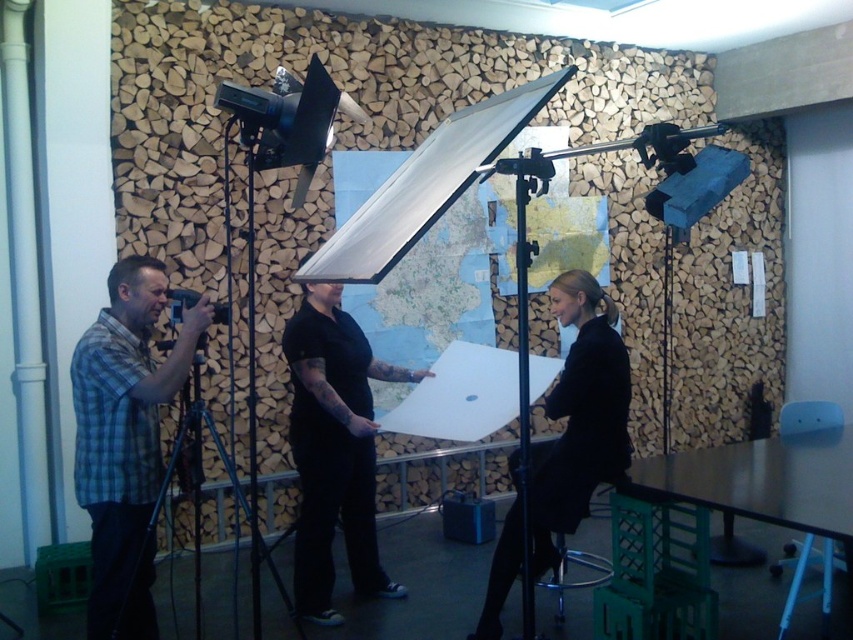
Question: Which point is closer to the camera?

Choices:
 (A) (149, 506)
 (B) (492, 621)
 (C) (328, 433)
 (D) (248, 516)

Answer: (A)

Question: Does black matte shirt at center come behind blue metallic tripod at left?

Choices:
 (A) no
 (B) yes

Answer: (B)

Question: Considering the real-world distances, which object is closest to the plaid shirt at left?

Choices:
 (A) blue metallic tripod at left
 (B) black matte dress at center
 (C) black matte shirt at center

Answer: (A)

Question: Among these objects, which one is farthest from the camera?

Choices:
 (A) plaid shirt at left
 (B) blue metallic tripod at left
 (C) black matte dress at center
 (D) black matte shirt at center

Answer: (D)

Question: Is the position of plaid shirt at left more distant than that of blue metallic tripod at left?

Choices:
 (A) no
 (B) yes

Answer: (B)

Question: Is plaid shirt at left above blue metallic tripod at left?

Choices:
 (A) yes
 (B) no

Answer: (A)